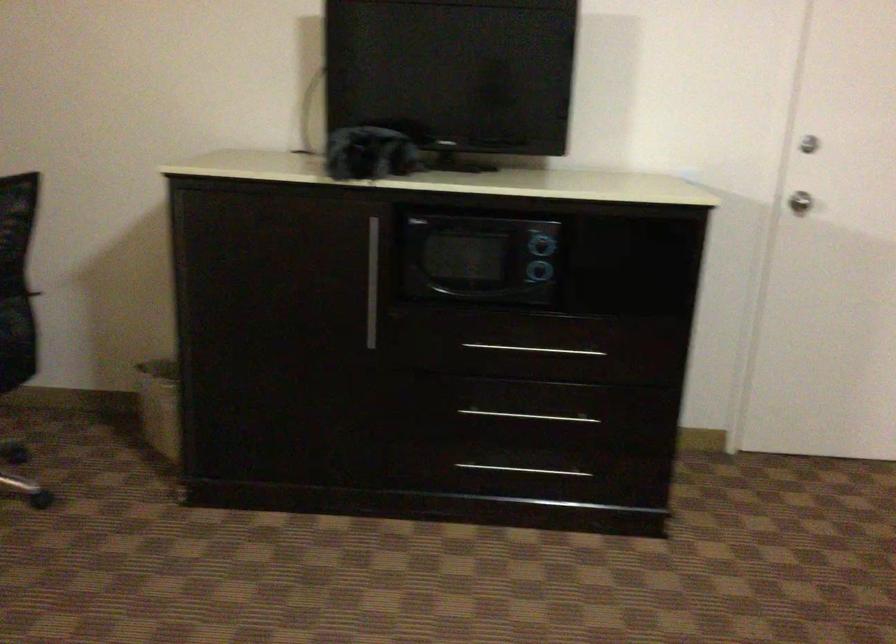
The height and width of the screenshot is (644, 896). In order to click on cabinet door handle in this screenshot , I will do `click(536, 346)`.